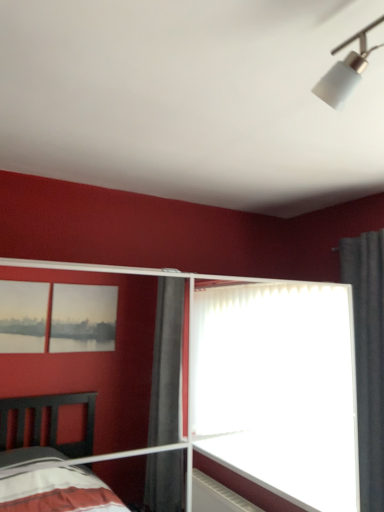
This screenshot has height=512, width=384. I want to click on gray fabric curtain at right, so click(368, 357).

The width and height of the screenshot is (384, 512). What do you see at coordinates (368, 357) in the screenshot?
I see `gray fabric curtain at right` at bounding box center [368, 357].

Image resolution: width=384 pixels, height=512 pixels. What do you see at coordinates (280, 387) in the screenshot?
I see `transparent glass door at center` at bounding box center [280, 387].

Where is `transparent glass door at center`? Image resolution: width=384 pixels, height=512 pixels. transparent glass door at center is located at coordinates (280, 387).

At what (x,y) coordinates should I click in order to perform the action: click on gray fabric curtain at right. Please return your answer as a coordinate pair (x, y). Looking at the image, I should click on (368, 357).

Between gray fabric curtain at right and transparent glass door at center, which one appears on the right side from the viewer's perspective?

gray fabric curtain at right.

Is gray fabric curtain at right in front of or behind transparent glass door at center in the image?

Visually, gray fabric curtain at right is located behind transparent glass door at center.

Between point (369, 326) and point (329, 451), which one is positioned behind?

Positioned behind is point (329, 451).

From the image's perspective, which one is positioned higher, gray fabric curtain at right or transparent glass door at center?

gray fabric curtain at right appears higher in the image.

From a real-world perspective, is gray fabric curtain at right positioned above or below transparent glass door at center?

In terms of real-world spatial position, gray fabric curtain at right is above transparent glass door at center.

Considering the sizes of gray fabric curtain at right and transparent glass door at center in the image, is gray fabric curtain at right wider or thinner than transparent glass door at center?

Considering their sizes, gray fabric curtain at right looks slimmer than transparent glass door at center.

Between gray fabric curtain at right and transparent glass door at center, which one has less height?

transparent glass door at center is shorter.

Which of these two, gray fabric curtain at right or transparent glass door at center, is smaller?

Smaller between the two is gray fabric curtain at right.

Would you say transparent glass door at center is part of gray fabric curtain at right's contents?

Definitely not — transparent glass door at center is not inside gray fabric curtain at right.

In the scene shown: Is gray fabric curtain at right in contact with transparent glass door at center?

They are not placed beside each other.

Is transparent glass door at center at the back of gray fabric curtain at right?

gray fabric curtain at right is not turned away from transparent glass door at center.

How many degrees apart are the facing directions of gray fabric curtain at right and transparent glass door at center?

The angular difference between gray fabric curtain at right and transparent glass door at center is 88.7 degrees.

How much distance is there between gray fabric curtain at right and transparent glass door at center?

gray fabric curtain at right is 26.12 inches from transparent glass door at center.

Find the location of a particular element. The width and height of the screenshot is (384, 512). glass door that is on the left side of gray fabric curtain at right is located at coordinates (280, 387).

Considering the relative positions of transparent glass door at center and gray fabric curtain at right in the image provided, is transparent glass door at center to the right of gray fabric curtain at right from the viewer's perspective?

Incorrect, transparent glass door at center is not on the right side of gray fabric curtain at right.

Which object is closer to the camera, transparent glass door at center or gray fabric curtain at right?

transparent glass door at center is more forward.

Between point (231, 323) and point (376, 362), which one is positioned behind?

The point (231, 323) is behind.

From the image's perspective, is transparent glass door at center located above gray fabric curtain at right?

No, from the image's perspective, transparent glass door at center is not over gray fabric curtain at right.

From a real-world perspective, relative to gray fabric curtain at right, is transparent glass door at center vertically above or below?

transparent glass door at center is situated lower than gray fabric curtain at right in the real world.

Is transparent glass door at center wider or thinner than gray fabric curtain at right?

Considering their sizes, transparent glass door at center looks broader than gray fabric curtain at right.

Does transparent glass door at center have a greater height compared to gray fabric curtain at right?

Incorrect, the height of transparent glass door at center is not larger of that of gray fabric curtain at right.

Considering the relative sizes of transparent glass door at center and gray fabric curtain at right in the image provided, is transparent glass door at center bigger than gray fabric curtain at right?

Indeed, transparent glass door at center has a larger size compared to gray fabric curtain at right.

Is gray fabric curtain at right located within transparent glass door at center?

No, gray fabric curtain at right is not surrounded by transparent glass door at center.

Is transparent glass door at center positioned far away from gray fabric curtain at right?

No, there isn't a large distance between transparent glass door at center and gray fabric curtain at right.

Is gray fabric curtain at right at the back of transparent glass door at center?

transparent glass door at center is not turned away from gray fabric curtain at right.

Can you tell me how much transparent glass door at center and gray fabric curtain at right differ in facing direction?

The angular difference between transparent glass door at center and gray fabric curtain at right is 88.7 degrees.

You are a GUI agent. You are given a task and a screenshot of the screen. Output one action in this format:
    pyautogui.click(x=<x>, y=<y>)
    Task: Click on the glass door on the left of gray fabric curtain at right
    The height and width of the screenshot is (512, 384).
    Given the screenshot: What is the action you would take?
    pyautogui.click(x=280, y=387)

You are a GUI agent. You are given a task and a screenshot of the screen. Output one action in this format:
    pyautogui.click(x=<x>, y=<y>)
    Task: Click on the glass door on the left side of gray fabric curtain at right
    
    Given the screenshot: What is the action you would take?
    pyautogui.click(x=280, y=387)

What are the coordinates of `glass door below the gray fabric curtain at right (from the image's perspective)` in the screenshot? It's located at (280, 387).